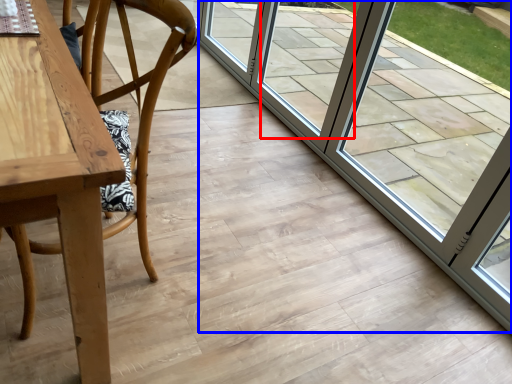
Question: Among these objects, which one is farthest to the camera, window (highlighted by a red box) or door (highlighted by a blue box)?

Choices:
 (A) window
 (B) door

Answer: (A)